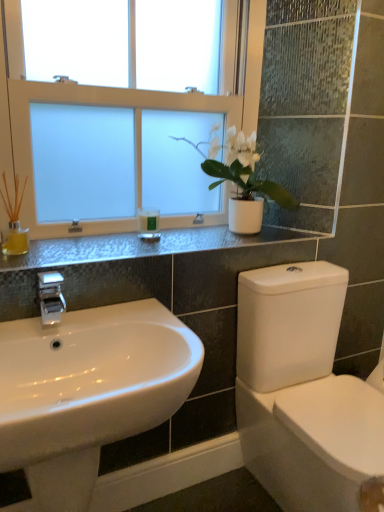
Question: From the image's perspective, does silver metallic faucet at left appear lower than white matte plant pot at upper center?

Choices:
 (A) no
 (B) yes

Answer: (B)

Question: From the image's perspective, does silver metallic faucet at left appear higher than white matte plant pot at upper center?

Choices:
 (A) yes
 (B) no

Answer: (B)

Question: Considering the relative sizes of silver metallic faucet at left and white matte plant pot at upper center in the image provided, is silver metallic faucet at left shorter than white matte plant pot at upper center?

Choices:
 (A) yes
 (B) no

Answer: (A)

Question: From a real-world perspective, does silver metallic faucet at left stand above white matte plant pot at upper center?

Choices:
 (A) yes
 (B) no

Answer: (B)

Question: Considering the relative sizes of silver metallic faucet at left and white matte plant pot at upper center in the image provided, is silver metallic faucet at left taller than white matte plant pot at upper center?

Choices:
 (A) no
 (B) yes

Answer: (A)

Question: Does silver metallic faucet at left have a lesser width compared to white matte plant pot at upper center?

Choices:
 (A) yes
 (B) no

Answer: (A)

Question: Can you confirm if metallic gray counter top at upper center is taller than white frosted glass window at upper center?

Choices:
 (A) yes
 (B) no

Answer: (B)

Question: From the image's perspective, is metallic gray counter top at upper center below white frosted glass window at upper center?

Choices:
 (A) yes
 (B) no

Answer: (A)

Question: Is metallic gray counter top at upper center turned away from white frosted glass window at upper center?

Choices:
 (A) yes
 (B) no

Answer: (B)

Question: Could you tell me if metallic gray counter top at upper center is facing white frosted glass window at upper center?

Choices:
 (A) yes
 (B) no

Answer: (B)

Question: Is metallic gray counter top at upper center positioned behind white frosted glass window at upper center?

Choices:
 (A) yes
 (B) no

Answer: (B)

Question: From a real-world perspective, is metallic gray counter top at upper center beneath white frosted glass window at upper center?

Choices:
 (A) no
 (B) yes

Answer: (B)

Question: From a real-world perspective, is white frosted glass window at upper center physically above green matte candle at center?

Choices:
 (A) yes
 (B) no

Answer: (A)